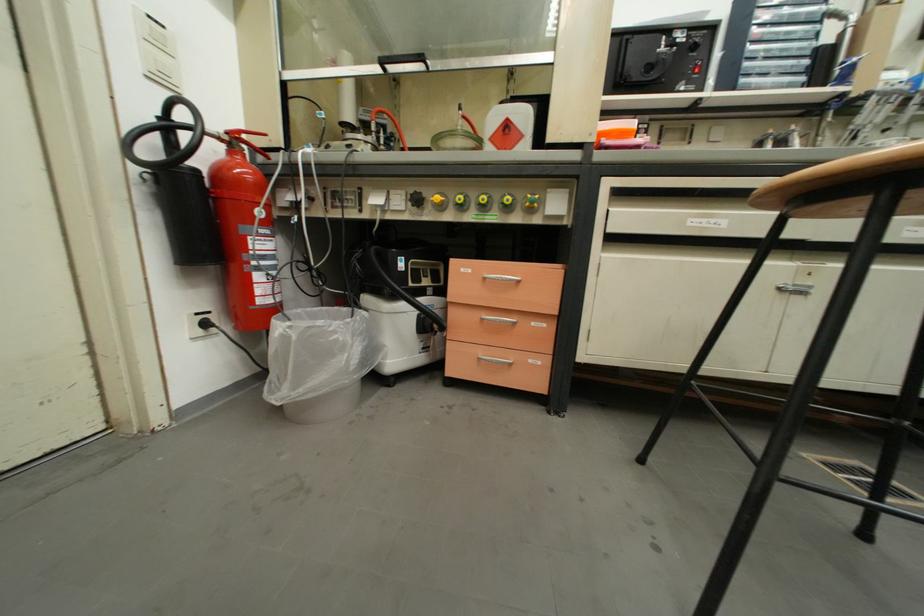
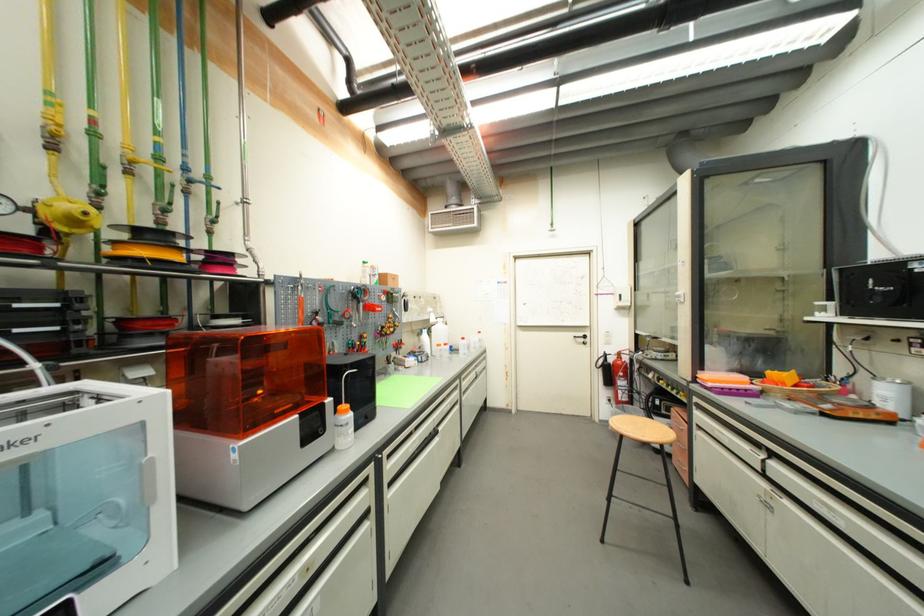
Where in the second image is the point corresponding to (280,270) from the first image?

(630, 391)